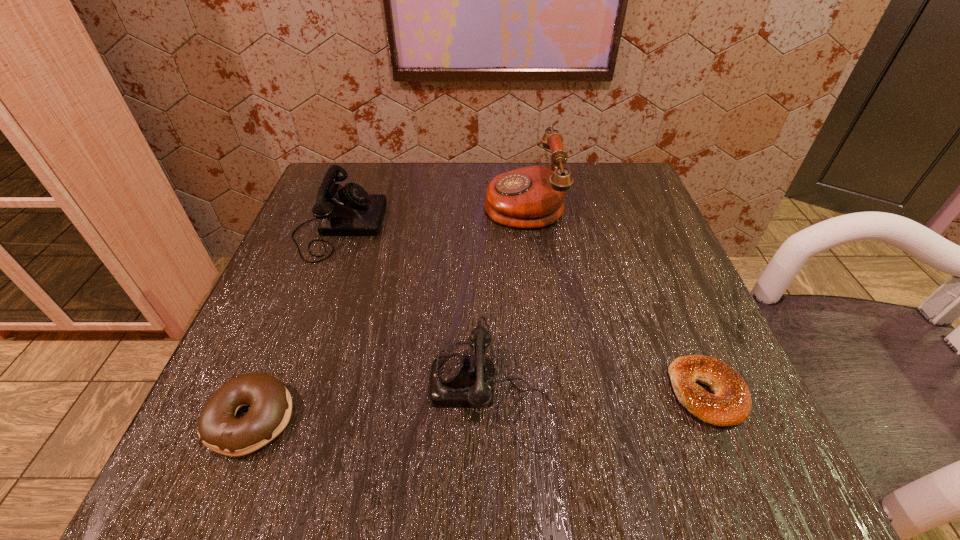
Locate an element on the screen. vacant space that is in between the nearest telephone and the second shortest telephone is located at coordinates (416, 307).

Locate an element on the screen. Image resolution: width=960 pixels, height=540 pixels. free space between the third tallest object and the tallest object is located at coordinates (508, 294).

Find the location of a particular element. The image size is (960, 540). free spot between the fourth shortest object and the doughnut is located at coordinates point(296,322).

I want to click on free space that is in between the leftmost telephone and the fourth tallest object, so click(x=296, y=322).

The height and width of the screenshot is (540, 960). In order to click on empty location between the tallest telephone and the bagel in this screenshot , I will do tap(615, 297).

Locate an element on the screen. This screenshot has height=540, width=960. free area in between the second tallest telephone and the tallest telephone is located at coordinates (431, 214).

Identify which object is the third closest to the doughnut. Please provide its 2D coordinates. Your answer should be formatted as a tuple, i.e. [(x, y)], where the tuple contains the x and y coordinates of a point satisfying the conditions above.

[(531, 197)]

Identify which object is the third nearest to the second shortest object. Please provide its 2D coordinates. Your answer should be formatted as a tuple, i.e. [(x, y)], where the tuple contains the x and y coordinates of a point satisfying the conditions above.

[(531, 197)]

I want to click on telephone object that ranks as the closest to the doughnut, so point(455,381).

What are the coordinates of `telephone that stands as the second closest to the shortest object` in the screenshot? It's located at (531, 197).